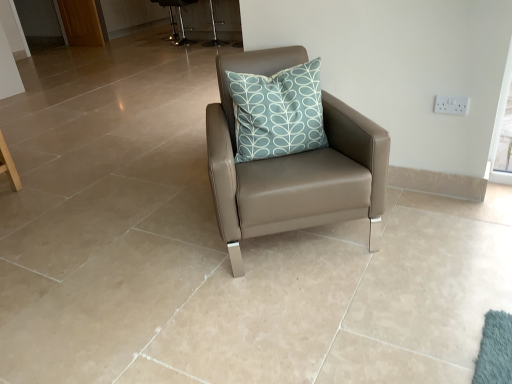
Question: Is metallic silver bar stool at upper center, arranged as the second bar stool when viewed from the left, in front of metallic silver bar stool at upper center, the second bar stool in the right-to-left sequence?

Choices:
 (A) no
 (B) yes

Answer: (B)

Question: Is metallic silver bar stool at upper center, which is the 1th bar stool in front-to-back order, next to metallic silver bar stool at upper center, the first bar stool when ordered from left to right, and touching it?

Choices:
 (A) no
 (B) yes

Answer: (A)

Question: Is metallic silver bar stool at upper center, the first bar stool in the right-to-left sequence, to the left of metallic silver bar stool at upper center, the second bar stool in the right-to-left sequence, from the viewer's perspective?

Choices:
 (A) no
 (B) yes

Answer: (A)

Question: Is metallic silver bar stool at upper center, the 2th bar stool from the back, looking in the opposite direction of metallic silver bar stool at upper center, the second bar stool in the right-to-left sequence?

Choices:
 (A) yes
 (B) no

Answer: (B)

Question: Considering the relative sizes of metallic silver bar stool at upper center, arranged as the second bar stool when viewed from the left, and metallic silver bar stool at upper center, the first bar stool when ordered from left to right, in the image provided, is metallic silver bar stool at upper center, arranged as the second bar stool when viewed from the left, shorter than metallic silver bar stool at upper center, the first bar stool when ordered from left to right,?

Choices:
 (A) no
 (B) yes

Answer: (A)

Question: Is white plastic electric outlet at upper right in front of or behind brown wooden screen door at upper left in the image?

Choices:
 (A) behind
 (B) front

Answer: (B)

Question: Considering the positions of point (437, 107) and point (55, 9), is point (437, 107) closer or farther from the camera than point (55, 9)?

Choices:
 (A) closer
 (B) farther

Answer: (A)

Question: From a real-world perspective, is white plastic electric outlet at upper right above or below brown wooden screen door at upper left?

Choices:
 (A) below
 (B) above

Answer: (B)

Question: From the image's perspective, is white plastic electric outlet at upper right positioned above or below brown wooden screen door at upper left?

Choices:
 (A) below
 (B) above

Answer: (A)

Question: Is teal printed cushion at center in front of or behind matte leather chair at center in the image?

Choices:
 (A) front
 (B) behind

Answer: (B)

Question: Considering the positions of point (326, 137) and point (275, 225), is point (326, 137) closer or farther from the camera than point (275, 225)?

Choices:
 (A) farther
 (B) closer

Answer: (A)

Question: Is teal printed cushion at center situated inside matte leather chair at center or outside?

Choices:
 (A) outside
 (B) inside

Answer: (B)

Question: From the image's perspective, relative to matte leather chair at center, is teal printed cushion at center above or below?

Choices:
 (A) below
 (B) above

Answer: (B)

Question: From the image's perspective, is teal printed cushion at center located above or below white plastic electric outlet at upper right?

Choices:
 (A) above
 (B) below

Answer: (B)

Question: Based on their positions, is teal printed cushion at center located to the left or right of white plastic electric outlet at upper right?

Choices:
 (A) right
 (B) left

Answer: (B)